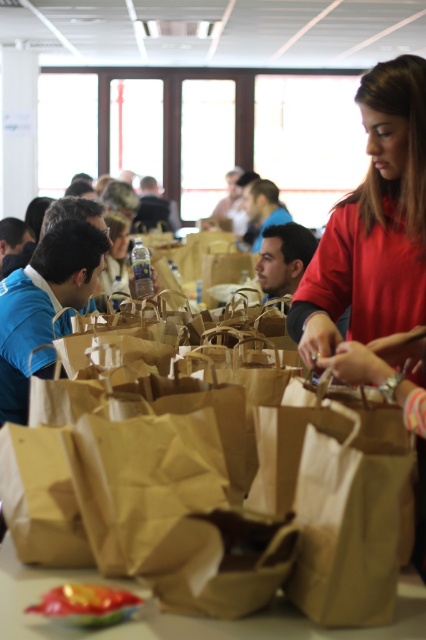
From the picture: You are standing in the room and want to move from point A to point B. Point A is at coordinate point [414,627] and point B is at coordinate point [60,616]. Which point is closer to you when you are facing the table with the paper bags?

Point B at coordinate point [60,616] is closer to you because it is less further away than point A at coordinate point [414,627].

You are a participant in the activity and need to choose a container to hold a large amount of snacks. Which one between the brown paper bag at lower center and the shiny plastic bowl at center would you recommend?

The brown paper bag at lower center has a larger size compared to the shiny plastic bowl at center, so it can hold more snacks.

You are standing in the room and want to place a new shiny plastic bowl at center. Is the point at coordinate (86, 604) on the shiny plastic bowl at center?

Yes, the point at coordinate (86, 604) is on the shiny plastic bowl at center according to the description.